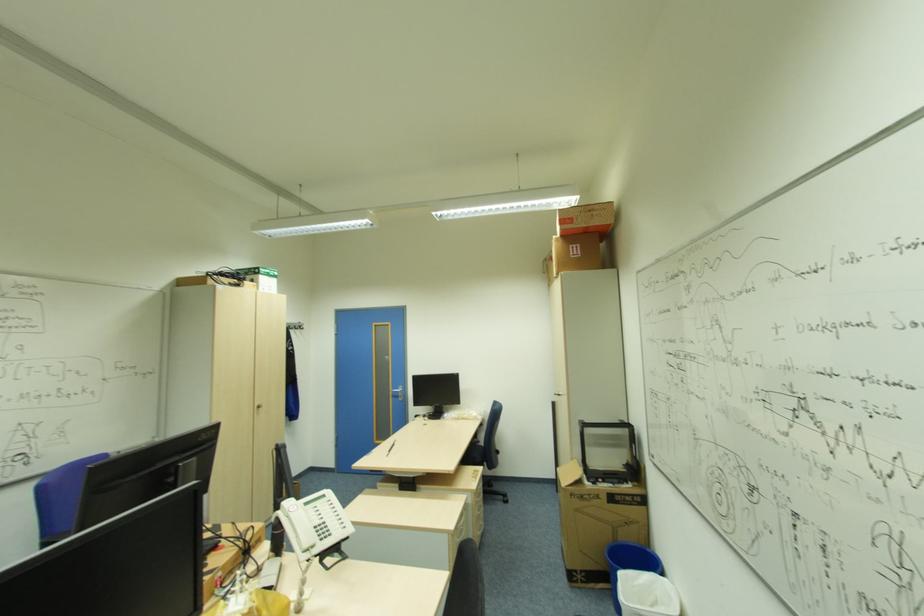
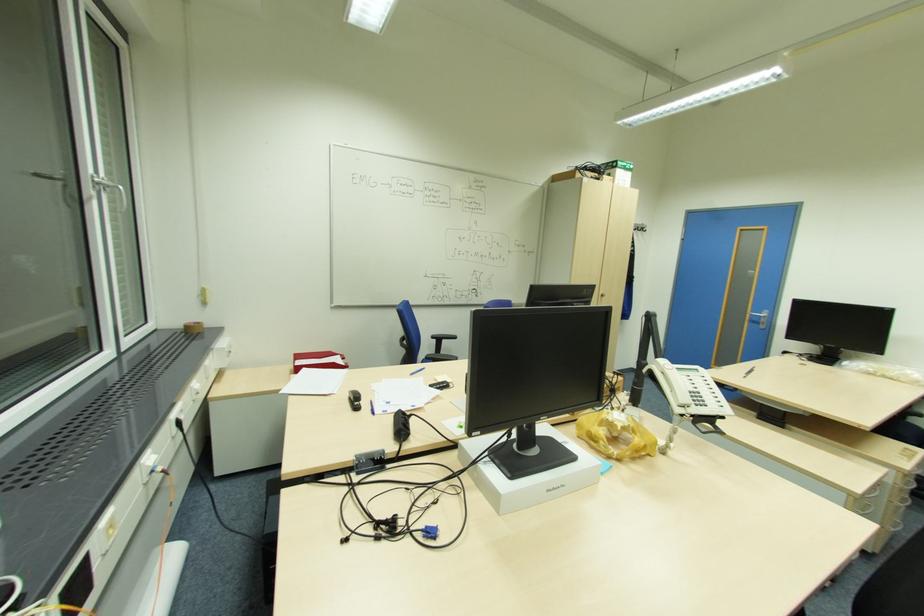
In the second image, find the point that corresponds to pixel 478 493 in the first image.

(907, 474)